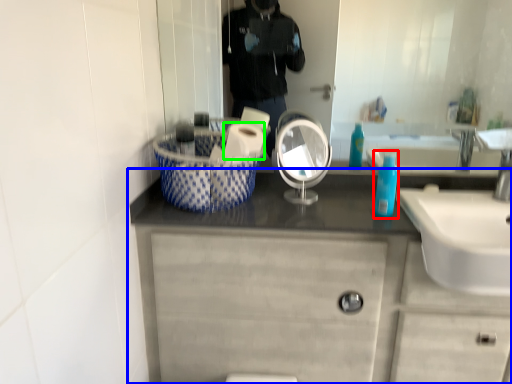
Question: Estimate the real-world distances between objects in this image. Which object is farther from mouthwash (highlighted by a red box), bathroom cabinet (highlighted by a blue box) or toilet paper (highlighted by a green box)?

Choices:
 (A) bathroom cabinet
 (B) toilet paper

Answer: (A)